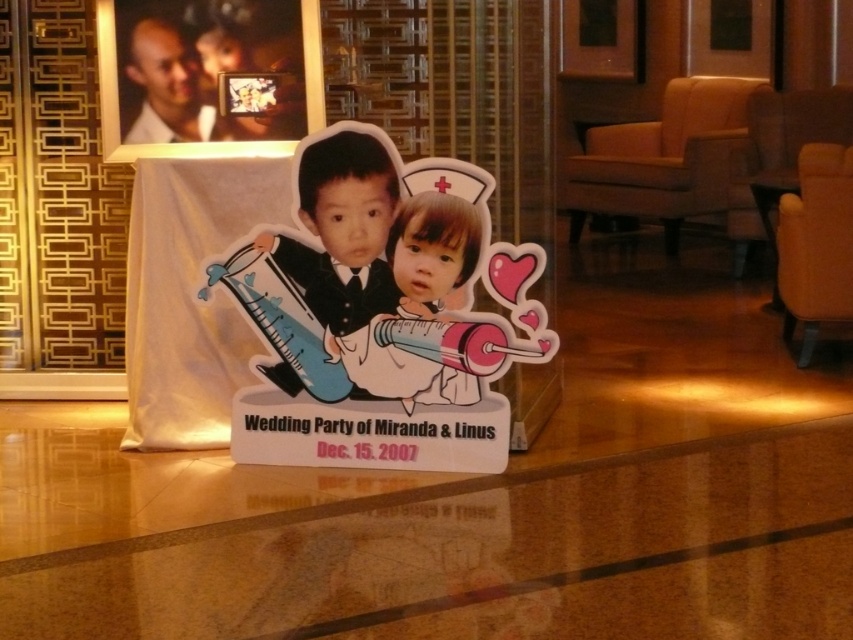
What do you see at coordinates (343, 227) in the screenshot? The width and height of the screenshot is (853, 640). I see `matte black suit at center` at bounding box center [343, 227].

Is matte black suit at center shorter than matte white child at center?

No, matte black suit at center is not shorter than matte white child at center.

Find the location of a particular element. matte black suit at center is located at coordinates (343, 227).

Where is `matte black suit at center`? The height and width of the screenshot is (640, 853). matte black suit at center is located at coordinates (343, 227).